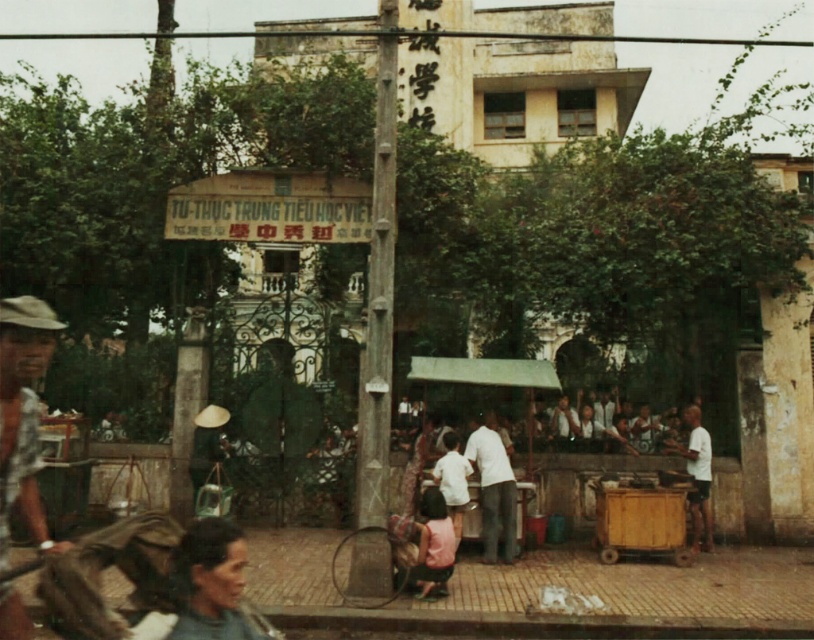
Does plaid fabric shirt at left lie in front of white matte shirt at center?

Yes, plaid fabric shirt at left is in front of white matte shirt at center.

In order to click on plaid fabric shirt at left in this screenshot , I will do `click(22, 413)`.

Where is `plaid fabric shirt at left`? This screenshot has height=640, width=814. plaid fabric shirt at left is located at coordinates (22, 413).

The width and height of the screenshot is (814, 640). Find the location of `plaid fabric shirt at left`. plaid fabric shirt at left is located at coordinates (22, 413).

Describe the element at coordinates (22, 413) in the screenshot. I see `plaid fabric shirt at left` at that location.

Is point (3, 593) positioned behind point (694, 513)?

No, (3, 593) is in front of (694, 513).

Is point (34, 339) positioned after point (703, 541)?

That is False.

Find the location of a particular element. plaid fabric shirt at left is located at coordinates (22, 413).

Can you confirm if white matte shirt at center is bigger than white matte shirt at lower right?

Indeed, white matte shirt at center has a larger size compared to white matte shirt at lower right.

In the scene shown: Who is more forward, (499, 497) or (694, 451)?

→ Point (499, 497) is in front.

What do you see at coordinates (493, 488) in the screenshot?
I see `white matte shirt at center` at bounding box center [493, 488].

At what (x,y) coordinates should I click in order to perform the action: click on white matte shirt at center. Please return your answer as a coordinate pair (x, y). Image resolution: width=814 pixels, height=640 pixels. Looking at the image, I should click on (493, 488).